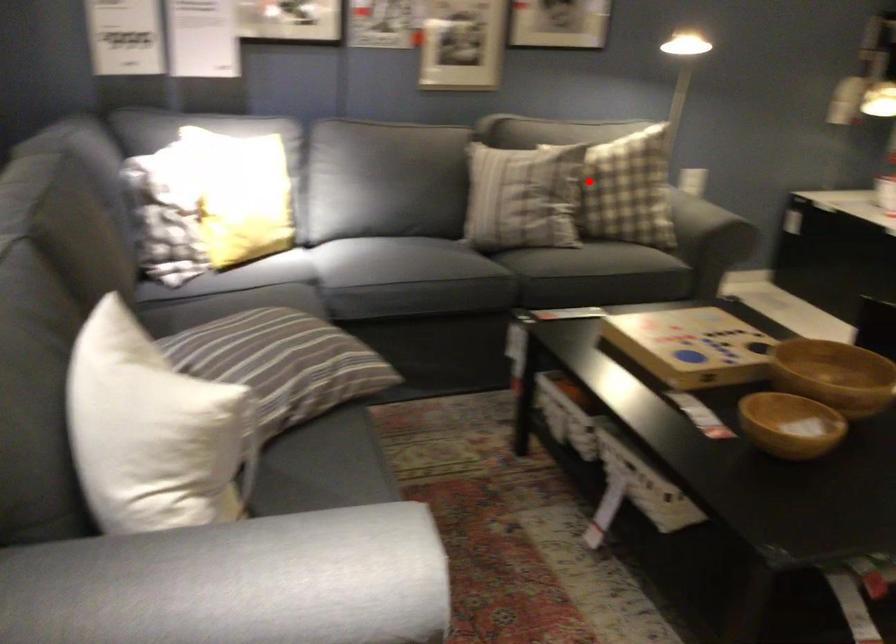
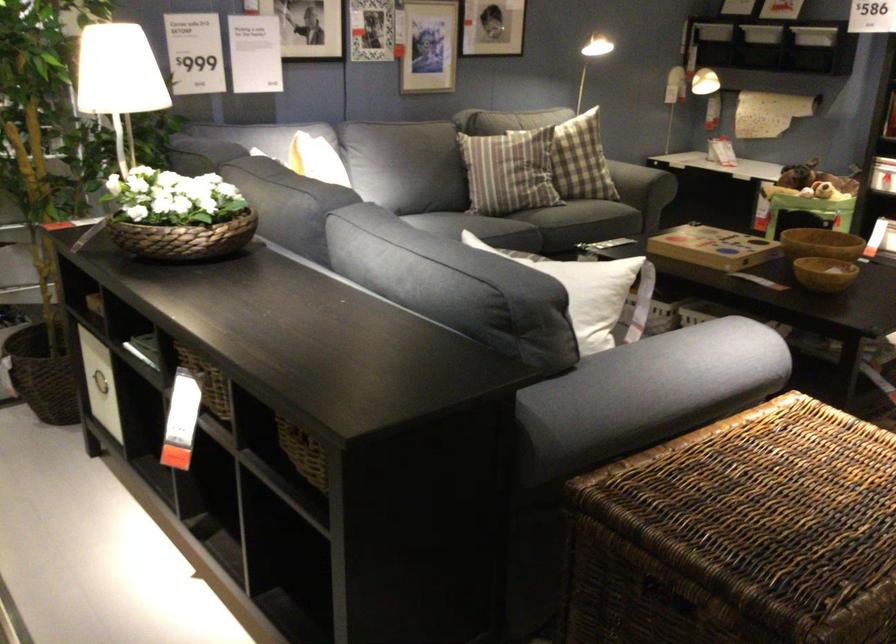
Question: I am providing you with two images of the same scene from different viewpoints. Given a red point in image1, look at the same physical point in image2. Is it:

Choices:
 (A) Closer to the viewpoint
 (B) Farther from the viewpoint

Answer: (B)